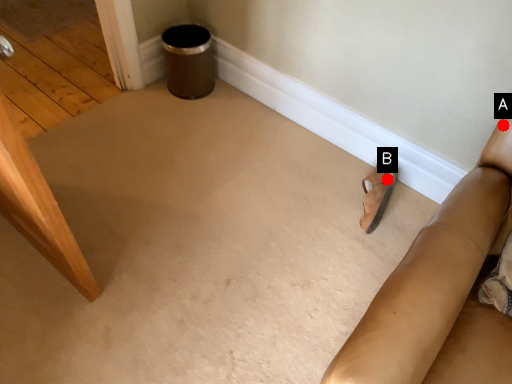
Question: Two points are circled on the image, labeled by A and B beside each circle. Which point is closer to the camera?

Choices:
 (A) A is closer
 (B) B is closer

Answer: (A)